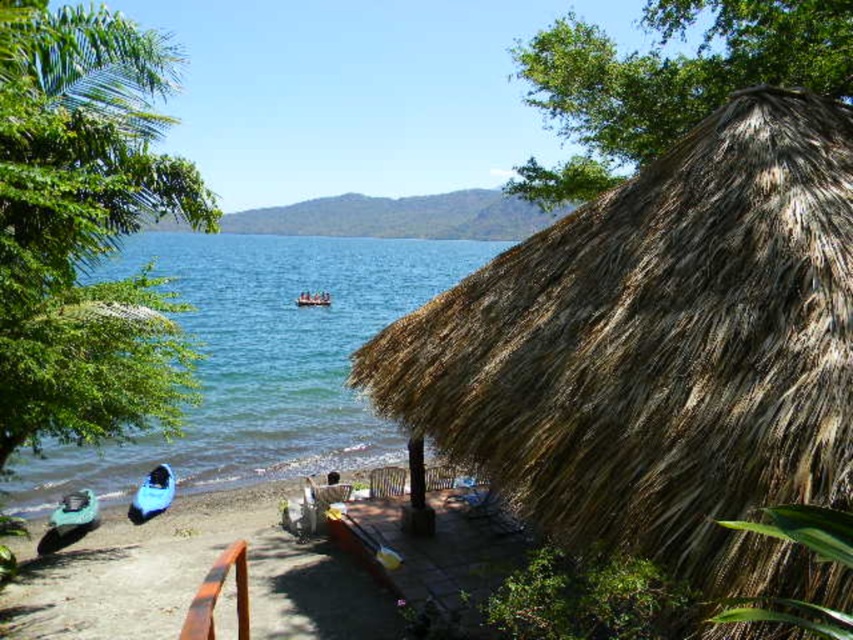
Can you confirm if blue water at center is shorter than blue plastic boat at lower left?

In fact, blue water at center may be taller than blue plastic boat at lower left.

Which of these two, blue water at center or blue plastic boat at lower left, stands taller?

Standing taller between the two is blue water at center.

Who is more forward, (122, 444) or (140, 515)?

Point (140, 515)

You are a GUI agent. You are given a task and a screenshot of the screen. Output one action in this format:
    pyautogui.click(x=<x>, y=<y>)
    Task: Click on the blue water at center
    The image size is (853, 640).
    Given the screenshot: What is the action you would take?
    pyautogui.click(x=262, y=358)

Is green leafy tree at upper right smaller than blue plastic boat at lower left?

Incorrect, green leafy tree at upper right is not smaller in size than blue plastic boat at lower left.

Is point (817, 68) farther from camera compared to point (161, 488)?

No, (817, 68) is closer to viewer.

Where is `green leafy tree at upper right`? The height and width of the screenshot is (640, 853). green leafy tree at upper right is located at coordinates (666, 81).

Does blue water at center have a smaller size compared to green leafy tree at upper right?

Actually, blue water at center might be larger than green leafy tree at upper right.

Which is more to the right, blue water at center or green leafy tree at upper right?

From the viewer's perspective, green leafy tree at upper right appears more on the right side.

This screenshot has width=853, height=640. What do you see at coordinates (262, 358) in the screenshot?
I see `blue water at center` at bounding box center [262, 358].

At what (x,y) coordinates should I click in order to perform the action: click on blue water at center. Please return your answer as a coordinate pair (x, y). The height and width of the screenshot is (640, 853). Looking at the image, I should click on (262, 358).